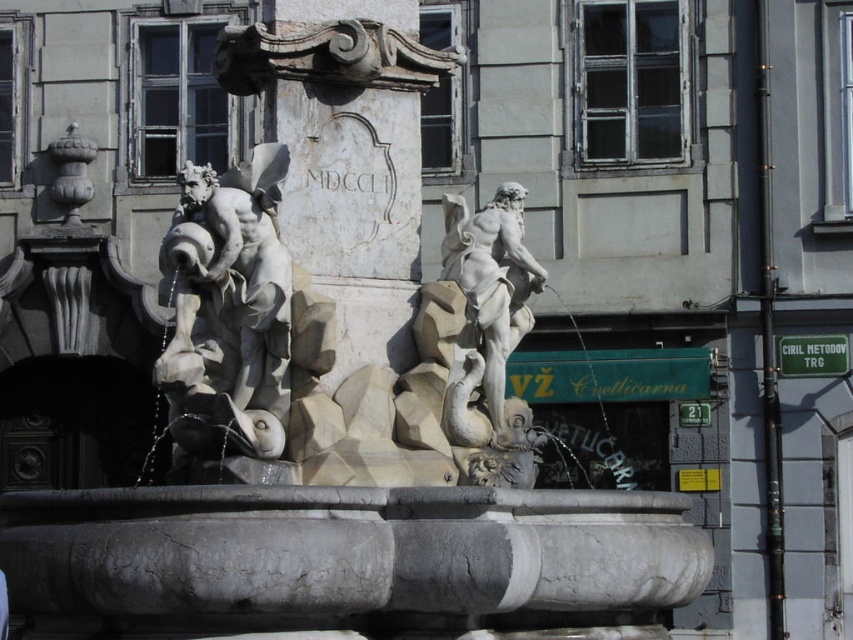
Which is behind, point (186, 204) or point (471, 228)?

Positioned behind is point (471, 228).

Between white marble statue at left and white marble statue at center, which one appears on the right side from the viewer's perspective?

From the viewer's perspective, white marble statue at center appears more on the right side.

This screenshot has height=640, width=853. Describe the element at coordinates (229, 305) in the screenshot. I see `white marble statue at left` at that location.

The width and height of the screenshot is (853, 640). Identify the location of white marble statue at left. (229, 305).